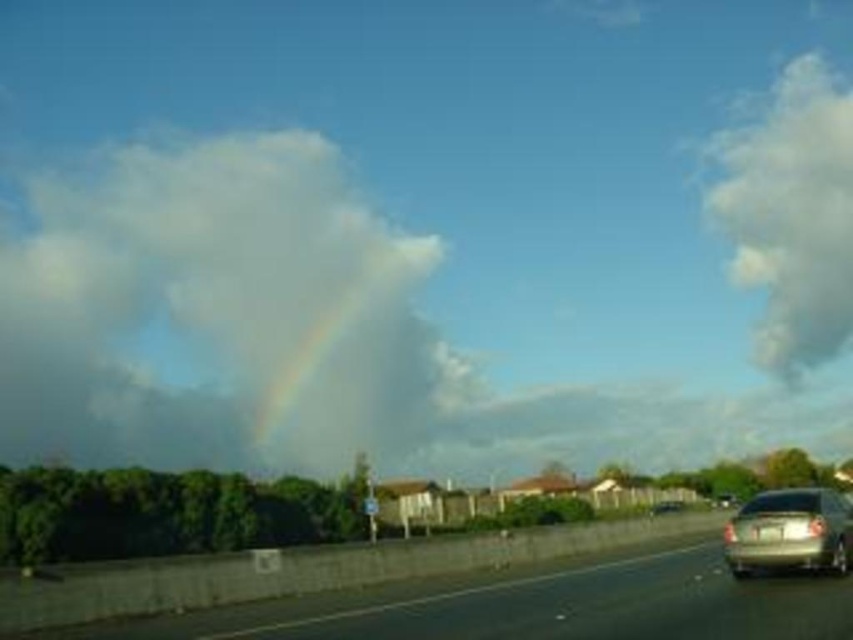
Question: Which object appears farthest from the camera in this image?

Choices:
 (A) silver metallic car at lower right
 (B) metallic asphalt highway at lower center
 (C) rainbow at center

Answer: (C)

Question: Which object is positioned farthest from the silver metallic car at lower right?

Choices:
 (A) white fluffy cloud at upper left
 (B) metallic asphalt highway at lower center

Answer: (A)

Question: Can you confirm if white fluffy cloud at upper left is bigger than rainbow at center?

Choices:
 (A) no
 (B) yes

Answer: (B)

Question: Does white fluffy cloud at upper left have a lesser width compared to white fluffy cloud at upper right?

Choices:
 (A) yes
 (B) no

Answer: (B)

Question: Which is farther from the silver metallic car at lower right?

Choices:
 (A) rainbow at center
 (B) white fluffy cloud at upper right
 (C) white fluffy cloud at upper left

Answer: (C)

Question: Can you confirm if rainbow at center is smaller than silver metallic car at lower right?

Choices:
 (A) yes
 (B) no

Answer: (B)